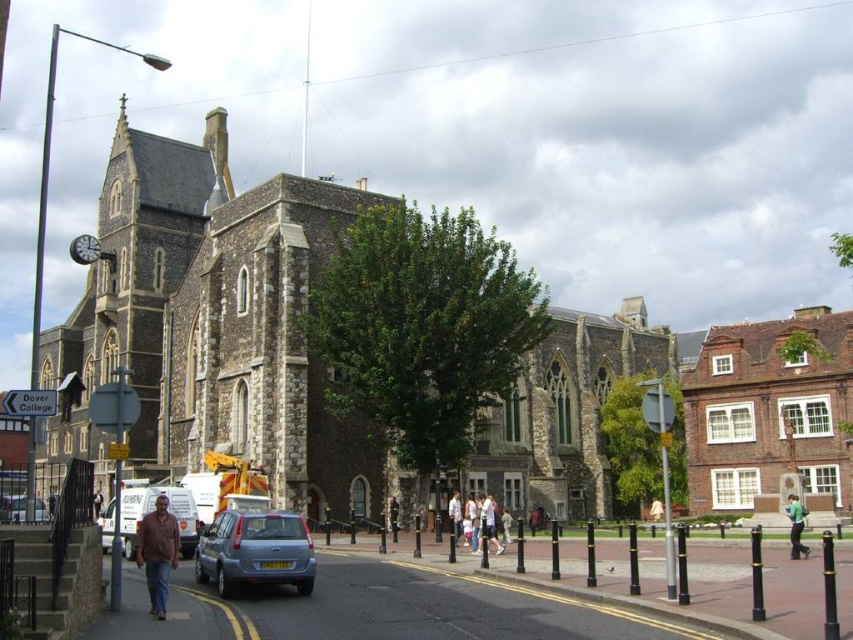
Question: Does stone church at center have a lesser width compared to light brown leather jacket at center?

Choices:
 (A) no
 (B) yes

Answer: (A)

Question: Among these objects, which one is farthest from the camera?

Choices:
 (A) stone church at center
 (B) brown leather jacket at center
 (C) green fabric jacket at center

Answer: (A)

Question: Which object is farther from the camera taking this photo?

Choices:
 (A) green fabric jacket at center
 (B) matte blue car at lower center
 (C) light brown leather jacket at center

Answer: (C)

Question: Can you confirm if stone church at center is smaller than brown leather jacket at lower left?

Choices:
 (A) yes
 (B) no

Answer: (B)

Question: Based on their relative distances, which object is farther from the stone church at center?

Choices:
 (A) brown leather jacket at lower left
 (B) matte blue car at lower center

Answer: (A)

Question: Does matte blue car at lower center have a greater width compared to dark brown leather jacket at center?

Choices:
 (A) no
 (B) yes

Answer: (B)